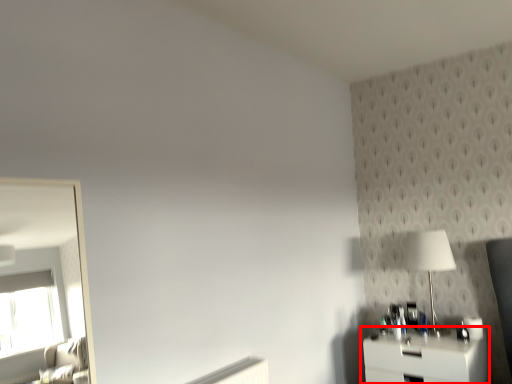
Question: From the image's perspective, considering the relative positions of nightstand (annotated by the red box) and table lamp in the image provided, where is nightstand (annotated by the red box) located with respect to the staircase?

Choices:
 (A) above
 (B) below

Answer: (B)